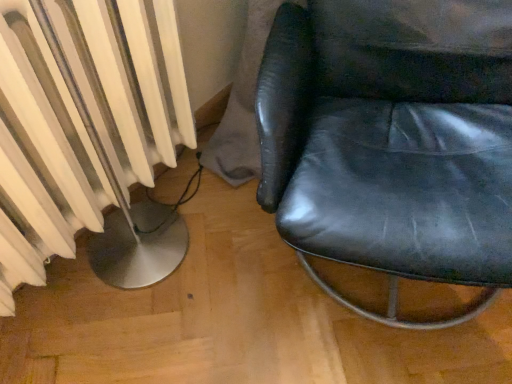
The width and height of the screenshot is (512, 384). Find the location of `white matte radiator at left`. white matte radiator at left is located at coordinates (91, 135).

Describe the element at coordinates (91, 135) in the screenshot. I see `white matte radiator at left` at that location.

This screenshot has width=512, height=384. What do you see at coordinates (392, 140) in the screenshot?
I see `black leather chair at right` at bounding box center [392, 140].

Locate an element on the screen. The image size is (512, 384). black leather chair at right is located at coordinates (392, 140).

You are a GUI agent. You are given a task and a screenshot of the screen. Output one action in this format:
    pyautogui.click(x=<x>, y=<y>)
    Task: Click on the white matte radiator at left
    
    Given the screenshot: What is the action you would take?
    pyautogui.click(x=91, y=135)

Between black leather chair at right and white matte radiator at left, which one appears on the left side from the viewer's perspective?

white matte radiator at left.

In the image, is black leather chair at right positioned in front of or behind white matte radiator at left?

black leather chair at right is positioned closer to the viewer than white matte radiator at left.

Is point (337, 112) behind point (185, 134)?

No.

From the image's perspective, who appears lower, black leather chair at right or white matte radiator at left?

white matte radiator at left appears lower in the image.

From a real-world perspective, is black leather chair at right physically located above or below white matte radiator at left?

black leather chair at right is below white matte radiator at left.

Considering the sizes of objects black leather chair at right and white matte radiator at left in the image provided, who is thinner, black leather chair at right or white matte radiator at left?

white matte radiator at left.

Is black leather chair at right shorter than white matte radiator at left?

No.

Is black leather chair at right bigger or smaller than white matte radiator at left?

Considering their sizes, black leather chair at right takes up more space than white matte radiator at left.

Is black leather chair at right located outside white matte radiator at left?

black leather chair at right is positioned outside white matte radiator at left.

Is black leather chair at right next to white matte radiator at left and touching it?

No.

Is black leather chair at right positioned with its back to white matte radiator at left?

That's not correct — black leather chair at right is not looking away from white matte radiator at left.

How different are the orientations of black leather chair at right and white matte radiator at left in degrees?

There is a 66.1-degree angle between the facing directions of black leather chair at right and white matte radiator at left.

This screenshot has width=512, height=384. I want to click on radiator lying on the left of black leather chair at right, so click(x=91, y=135).

Considering the positions of objects white matte radiator at left and black leather chair at right in the image provided, who is more to the left, white matte radiator at left or black leather chair at right?

white matte radiator at left is more to the left.

Considering their positions, is white matte radiator at left located in front of or behind black leather chair at right?

white matte radiator at left is positioned farther from the viewer than black leather chair at right.

Between point (148, 44) and point (474, 218), which one is positioned behind?

Point (148, 44)

From the image's perspective, which is below, white matte radiator at left or black leather chair at right?

From the image's view, white matte radiator at left is below.

From a real-world perspective, which is physically above, white matte radiator at left or black leather chair at right?

In real-world perspective, white matte radiator at left is above.

Which of these two, white matte radiator at left or black leather chair at right, is thinner?

white matte radiator at left.

Who is shorter, white matte radiator at left or black leather chair at right?

white matte radiator at left.

Does white matte radiator at left have a larger size compared to black leather chair at right?

No, white matte radiator at left is not bigger than black leather chair at right.

Choose the correct answer: Is white matte radiator at left inside black leather chair at right or outside it?

white matte radiator at left is spatially situated outside black leather chair at right.

Is white matte radiator at left placed right next to black leather chair at right?

They are not placed beside each other.

Is black leather chair at right at the back of white matte radiator at left?

white matte radiator at left does not have its back to black leather chair at right.

How different are the orientations of white matte radiator at left and black leather chair at right in degrees?

They differ by 66.1 degrees in their facing directions.

Measure the distance from white matte radiator at left to black leather chair at right.

white matte radiator at left and black leather chair at right are 16.74 inches apart.

Identify the location of radiator behind the black leather chair at right. The width and height of the screenshot is (512, 384). (91, 135).

Find the location of a particular element. The height and width of the screenshot is (384, 512). radiator lying below the black leather chair at right (from the image's perspective) is located at coordinates [x=91, y=135].

The height and width of the screenshot is (384, 512). I want to click on chair below the white matte radiator at left (from a real-world perspective), so click(392, 140).